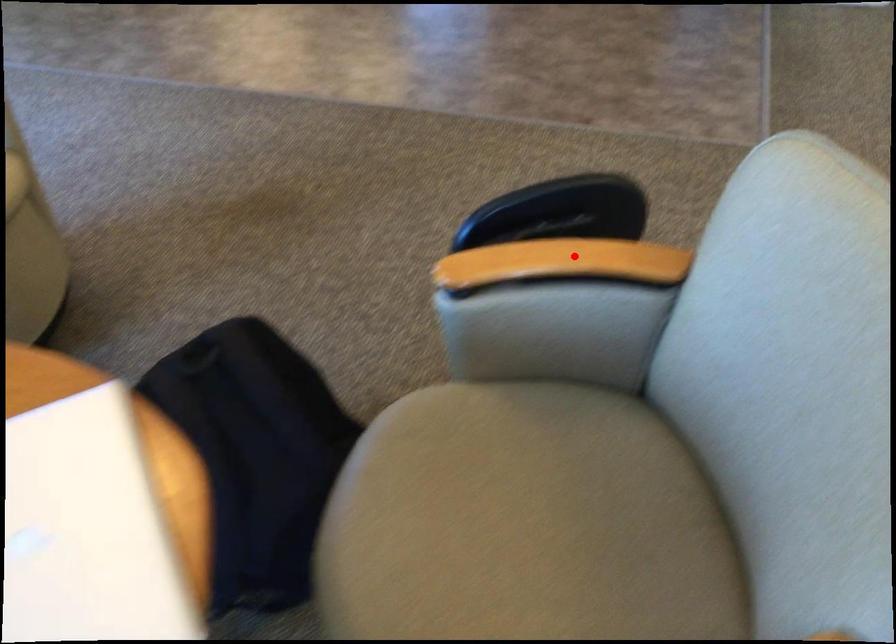
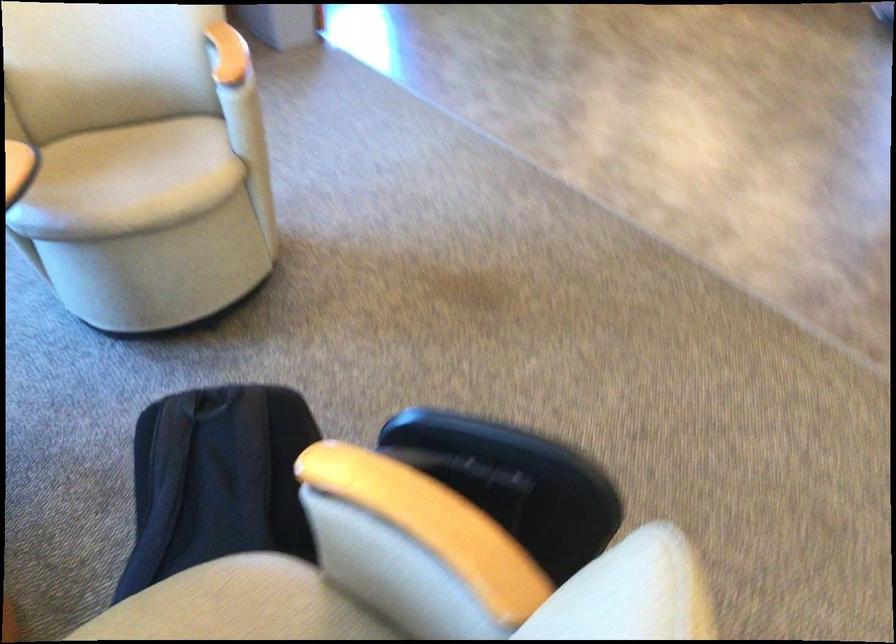
Question: I am providing you with two images of the same scene from different viewpoints. In image1, a red point is highlighted. Considering the same 3D point in image2, which of the following is correct?

Choices:
 (A) It is closer
 (B) It is farther

Answer: (A)